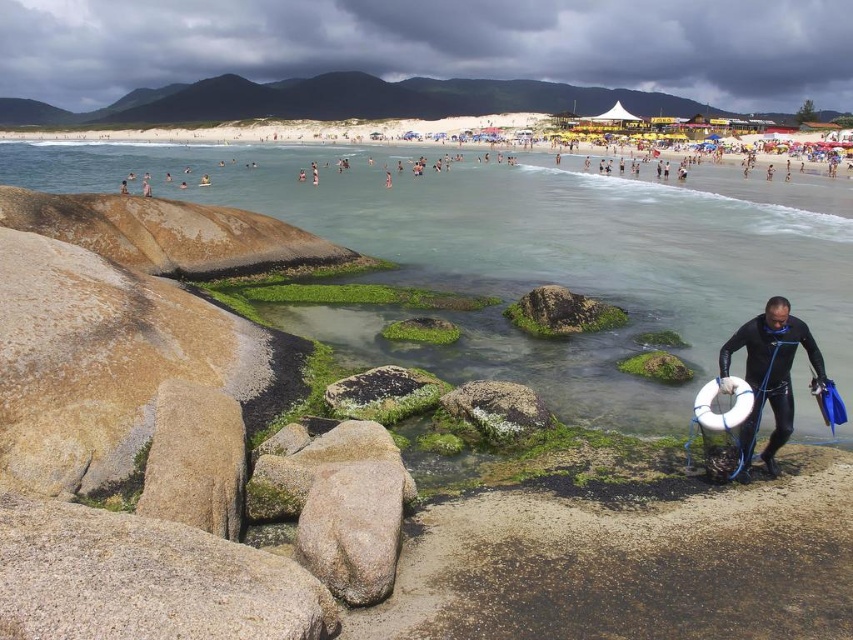
You are a photographer standing on the beach and want to capture both the gray rough rock at center and the black wetsuit at lower right in the same frame. Which object should you zoom in or out to include both?

Since the gray rough rock at center is shorter than the black wetsuit at lower right, you should zoom out to include both objects in the frame.

You are standing on the beach and see the gray granite rock at lower left and the black wetsuit at lower right. Which object is closer to the waterline?

The gray granite rock at lower left is closer to the waterline because it is positioned under the black wetsuit at lower right, indicating it is lower in the scene and nearer to the shore.

You are standing on the beach and see the gray granite rock at lower left and the black wetsuit at lower right. Which object is positioned more to the left side of the scene?

The gray granite rock at lower left is positioned more to the left side of the scene than the black wetsuit at lower right.